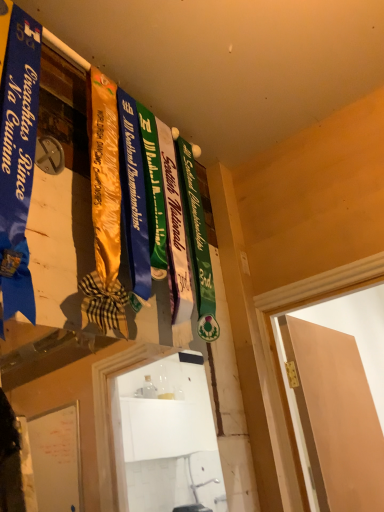
Question: From their relative heights in the image, would you say matte peach door at right is taller or shorter than blue satin ribbon at left?

Choices:
 (A) tall
 (B) short

Answer: (B)

Question: Which is correct: matte peach door at right is inside blue satin ribbon at left, or outside of it?

Choices:
 (A) outside
 (B) inside

Answer: (A)

Question: Based on their sizes in the image, would you say matte peach door at right is bigger or smaller than blue satin ribbon at left?

Choices:
 (A) small
 (B) big

Answer: (B)

Question: From the image's perspective, is blue satin ribbon at left located above or below matte peach door at right?

Choices:
 (A) below
 (B) above

Answer: (B)

Question: Is blue satin ribbon at left wider or thinner than matte peach door at right?

Choices:
 (A) wide
 (B) thin

Answer: (A)

Question: Looking at the image, does blue satin ribbon at left seem bigger or smaller compared to matte peach door at right?

Choices:
 (A) big
 (B) small

Answer: (B)

Question: Is point (8, 145) closer or farther from the camera than point (362, 500)?

Choices:
 (A) closer
 (B) farther

Answer: (A)